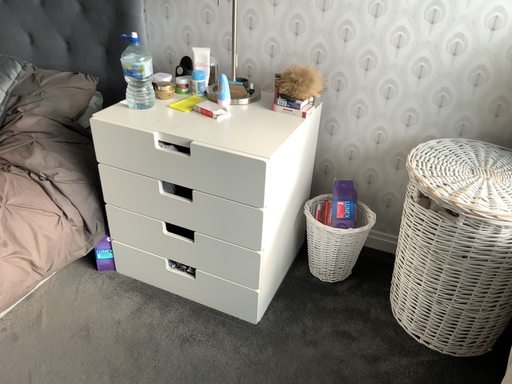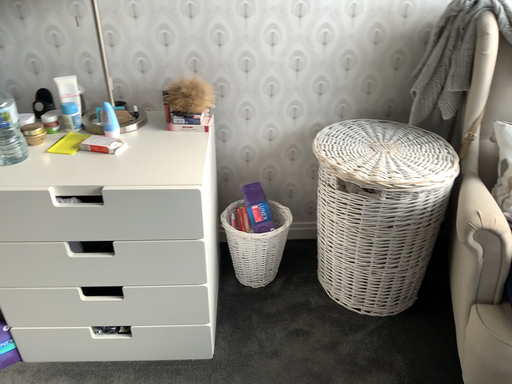
Question: Which way did the camera rotate in the video?

Choices:
 (A) rotated left
 (B) rotated right

Answer: (B)